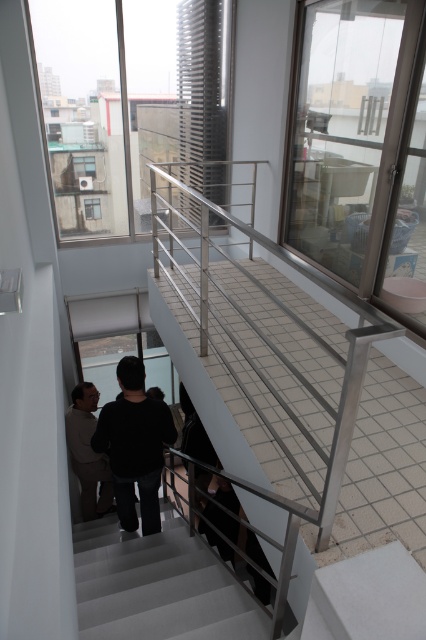
Looking at this image, you are moving a rack that is 1.2 meters wide and need to pass through the space between the black matte sweater at center and the light brown leather jacket at lower left. Can the rack fit through?

The black matte sweater at center is larger than the light brown leather jacket at lower left. However, the exact distance between them isn t specified in the objects description. Without knowing the space between the two items, it s impossible to determine if the rack will fit.

You are standing at the bottom of the staircase and want to reach the balcony. There are two points marked on the floor of the staircase. The first point is at coordinates point (123, 586) and the second point is at point (81, 410). Which point should you step on first to move towards the balcony?

You should step on point (123, 586) first because it is in front of point (81, 410), meaning it is closer to the balcony direction.